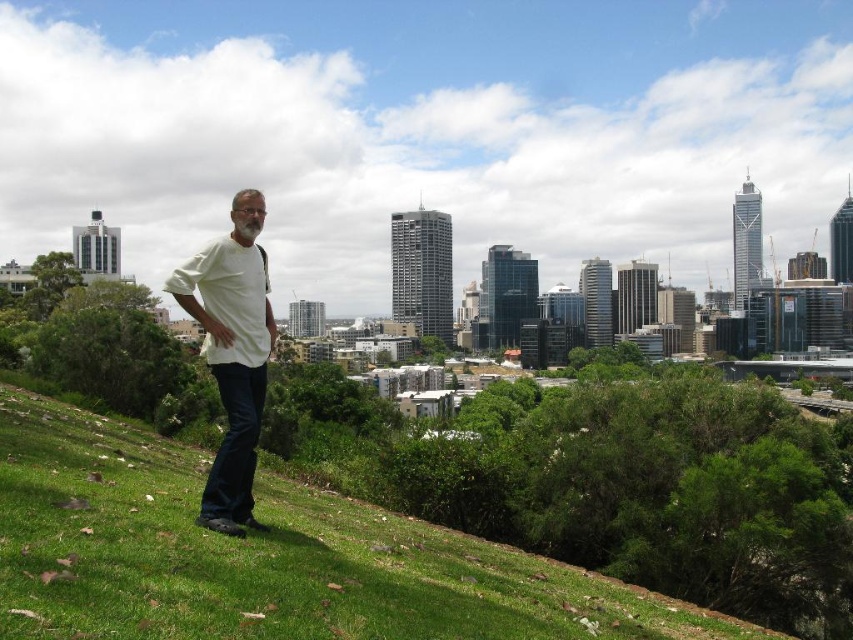
Question: Which point is closer to the camera?

Choices:
 (A) (x=234, y=372)
 (B) (x=80, y=426)

Answer: (B)

Question: Among these objects, which one is nearest to the camera?

Choices:
 (A) green grass at lower left
 (B) white matte shirt at center

Answer: (A)

Question: Is green grass at lower left bigger than white matte shirt at center?

Choices:
 (A) yes
 (B) no

Answer: (A)

Question: In this image, where is green grass at lower left located relative to white matte shirt at center?

Choices:
 (A) above
 (B) below

Answer: (B)

Question: Is green grass at lower left smaller than white matte shirt at center?

Choices:
 (A) no
 (B) yes

Answer: (A)